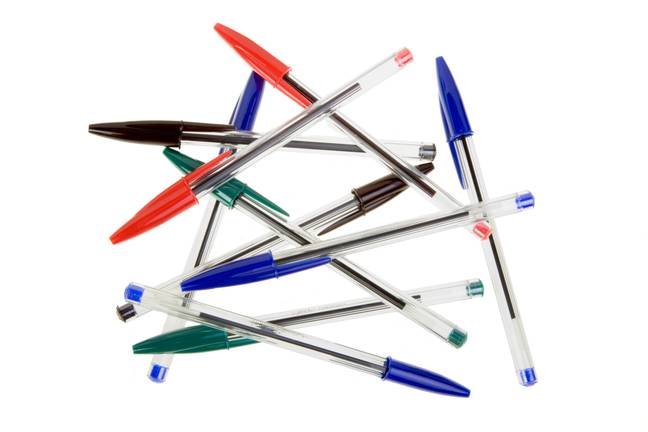
At what (x,y) coordinates should I click in order to perform the action: click on green and red pens. Please return your answer as a coordinate pair (x, y). The image size is (648, 432). Looking at the image, I should click on (196, 338), (232, 190), (168, 201), (260, 57).